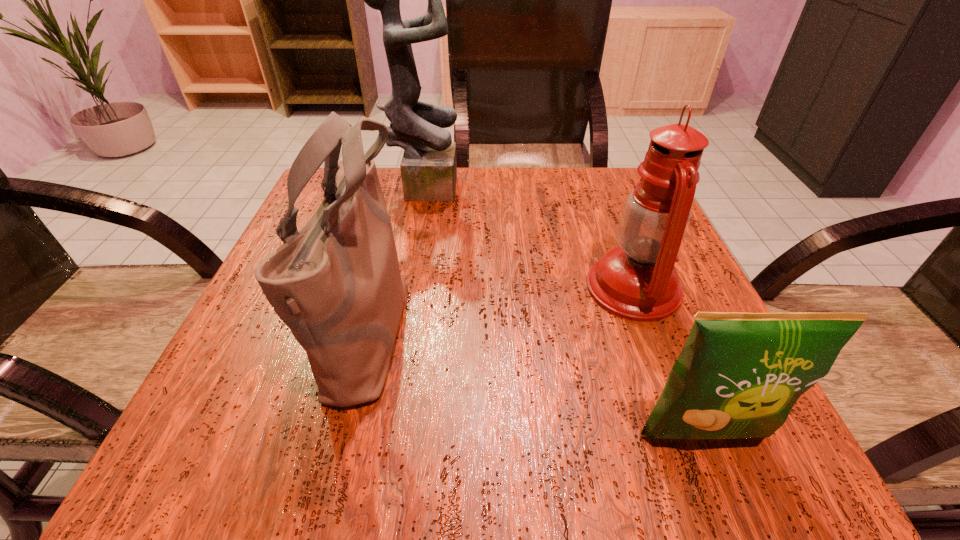
Locate which object is the second closest to the sculpture. Please provide its 2D coordinates. Your answer should be formatted as a tuple, i.e. [(x, y)], where the tuple contains the x and y coordinates of a point satisfying the conditions above.

[(637, 281)]

Identify which object is the third nearest to the sculpture. Please provide its 2D coordinates. Your answer should be formatted as a tuple, i.e. [(x, y)], where the tuple contains the x and y coordinates of a point satisfying the conditions above.

[(738, 375)]

Locate an element on the screen. vacant area in the image that satisfies the following two spatial constraints: 1. on the face of the oil lamp; 2. on the right side of the sculpture is located at coordinates (405, 288).

Locate an element on the screen. free space that satisfies the following two spatial constraints: 1. on the face of the sculpture; 2. on the left side of the oil lamp is located at coordinates (405, 288).

The width and height of the screenshot is (960, 540). Find the location of `blank area in the image that satisfies the following two spatial constraints: 1. on the face of the tallest object; 2. on the right side of the oil lamp`. blank area in the image that satisfies the following two spatial constraints: 1. on the face of the tallest object; 2. on the right side of the oil lamp is located at coordinates (405, 288).